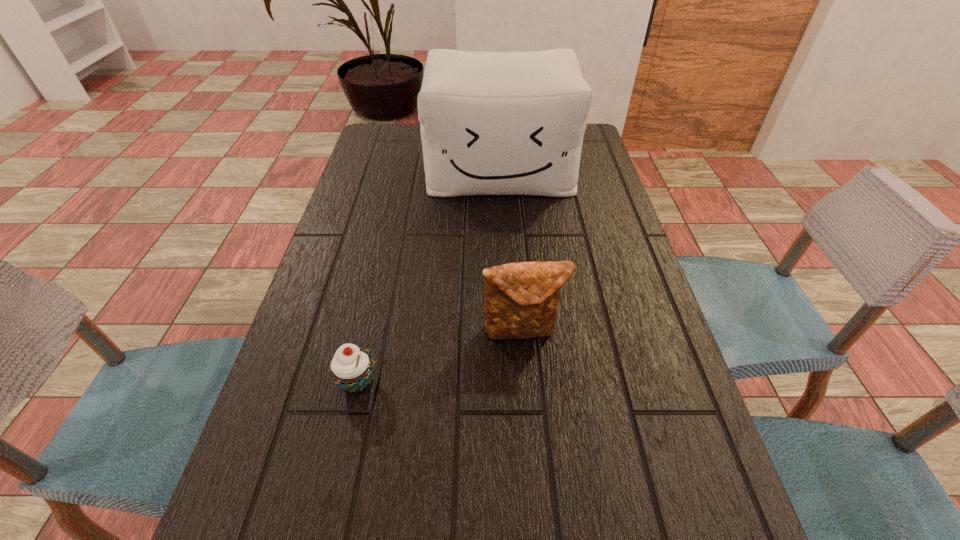
Where is `object situated at the left edge`? The width and height of the screenshot is (960, 540). object situated at the left edge is located at coordinates (351, 367).

Find the location of a particular element. This screenshot has height=540, width=960. object at the right edge is located at coordinates [x=492, y=123].

At what (x,y) coordinates should I click in order to perform the action: click on object that is at the far right corner. Please return your answer as a coordinate pair (x, y). This screenshot has height=540, width=960. Looking at the image, I should click on (492, 123).

Where is `free location at the far edge of the desktop`? This screenshot has height=540, width=960. free location at the far edge of the desktop is located at coordinates (420, 152).

In the image, there is a desktop. Identify the location of vacant space at the left edge. (305, 529).

This screenshot has width=960, height=540. Identify the location of free spot at the far left corner of the desktop. (377, 144).

The image size is (960, 540). Identify the location of free space between the second shortest object and the cupcake. (440, 356).

The width and height of the screenshot is (960, 540). I want to click on free space between the clutch bag and the tallest object, so click(x=512, y=250).

I want to click on vacant space in between the second farthest object and the cushion, so tap(512, 250).

Where is `vacant point located between the second tallest object and the farthest object`? vacant point located between the second tallest object and the farthest object is located at coordinates (512, 250).